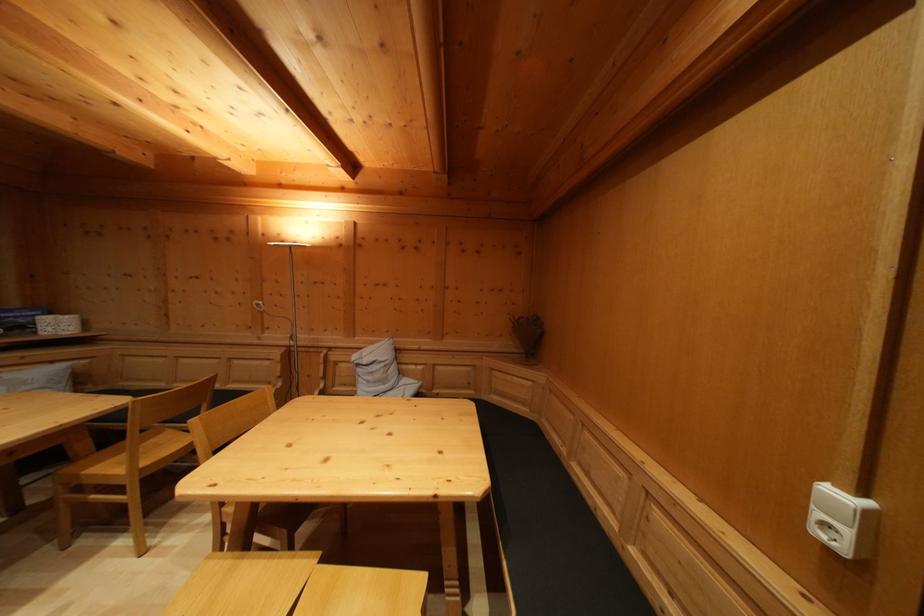
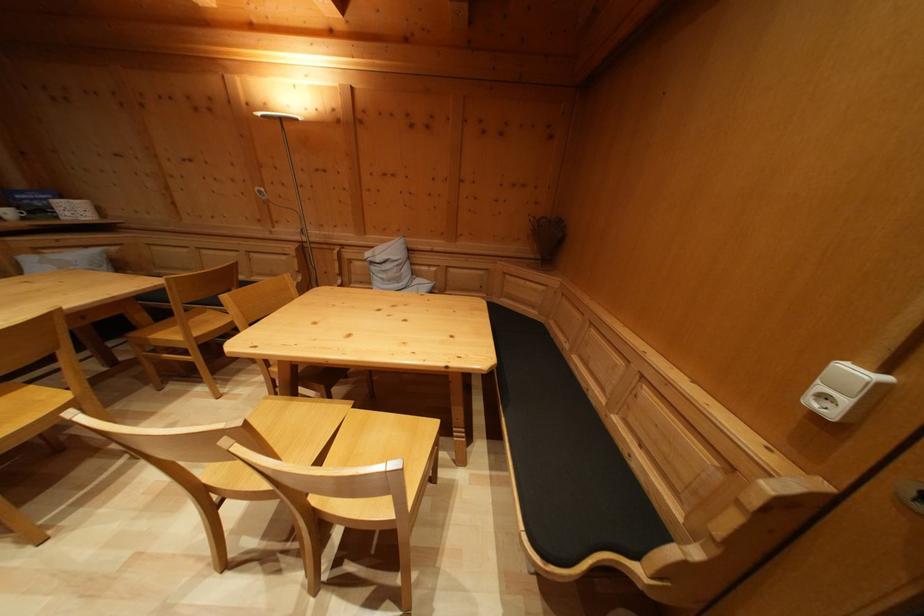
Question: I am providing you with two images of the same scene from different viewpoints. Which of the following objects are not visible in image2?

Choices:
 (A) bench sitting surface
 (B) white cup
 (C) white light switch
 (D) none of these

Answer: (D)